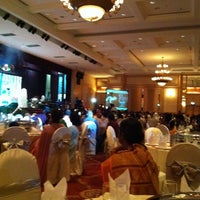
Identify the location of light on wall. (171, 95).